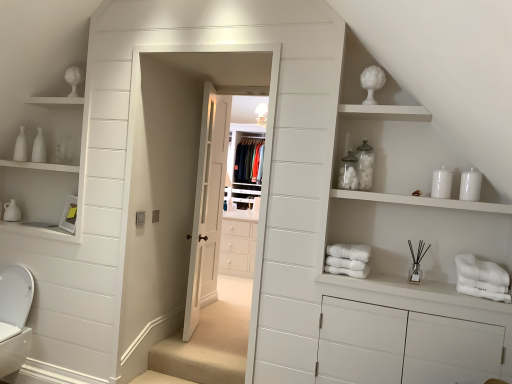
Question: Considering the relative sizes of white glossy toilet bowl at lower left and white cotton bath towel at lower right, the 1th bath towel positioned from the right, in the image provided, is white glossy toilet bowl at lower left shorter than white cotton bath towel at lower right, the 1th bath towel positioned from the right,?

Choices:
 (A) yes
 (B) no

Answer: (B)

Question: Is white glossy toilet bowl at lower left oriented towards white cotton bath towel at lower right, the 1th bath towel positioned from the right?

Choices:
 (A) yes
 (B) no

Answer: (B)

Question: Can you confirm if white glossy toilet bowl at lower left is wider than white cotton bath towel at lower right, which is the 2th bath towel in left-to-right order?

Choices:
 (A) yes
 (B) no

Answer: (B)

Question: Can you confirm if white glossy toilet bowl at lower left is positioned to the right of white cotton bath towel at lower right, the 1th bath towel positioned from the right?

Choices:
 (A) yes
 (B) no

Answer: (B)

Question: From a real-world perspective, is white glossy toilet bowl at lower left located beneath white cotton bath towel at lower right, the 1th bath towel positioned from the right?

Choices:
 (A) no
 (B) yes

Answer: (B)

Question: From the image's perspective, would you say white glossy toilet bowl at lower left is shown under white cotton bath towel at lower right, the 1th bath towel positioned from the right?

Choices:
 (A) no
 (B) yes

Answer: (B)

Question: Can you confirm if white soft bath towel at center, which is counted as the 1th bath towel, starting from the left, is positioned to the left of white cotton bath towel at lower right, the 1th bath towel positioned from the right?

Choices:
 (A) no
 (B) yes

Answer: (B)

Question: Is white soft bath towel at center, which is counted as the 1th bath towel, starting from the left, facing away from white cotton bath towel at lower right, the 1th bath towel positioned from the right?

Choices:
 (A) yes
 (B) no

Answer: (B)

Question: Is white cotton bath towel at lower right, the 1th bath towel positioned from the right, inside white soft bath towel at center, which ranks as the 2th bath towel in right-to-left order?

Choices:
 (A) yes
 (B) no

Answer: (B)

Question: Is white soft bath towel at center, which is counted as the 1th bath towel, starting from the left, thinner than white cotton bath towel at lower right, which is the 2th bath towel in left-to-right order?

Choices:
 (A) no
 (B) yes

Answer: (B)

Question: From the image's perspective, is white soft bath towel at center, which is counted as the 1th bath towel, starting from the left, under white cotton bath towel at lower right, the 1th bath towel positioned from the right?

Choices:
 (A) yes
 (B) no

Answer: (B)

Question: From the image's perspective, is white soft bath towel at center, which is counted as the 1th bath towel, starting from the left, on white cotton bath towel at lower right, which is the 2th bath towel in left-to-right order?

Choices:
 (A) no
 (B) yes

Answer: (B)

Question: Can you see white wooden door at center touching white soft bath towel at center, which ranks as the 2th bath towel in right-to-left order?

Choices:
 (A) yes
 (B) no

Answer: (B)